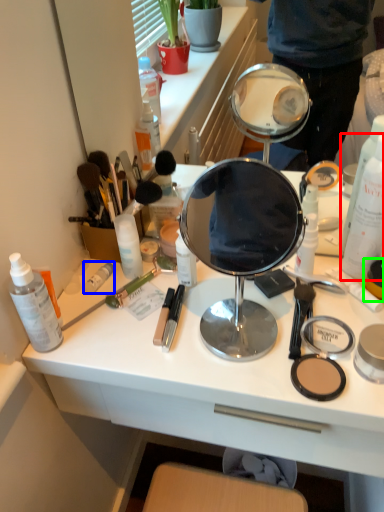
Question: Based on their relative distances, which object is nearer to bottle (highlighted by a red box)? Choose from toiletry (highlighted by a blue box) and toiletry (highlighted by a green box).

Choices:
 (A) toiletry
 (B) toiletry

Answer: (B)